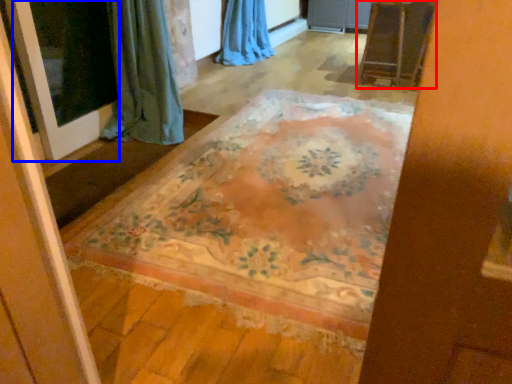
Question: Which of the following is the farthest to the observer, furniture (highlighted by a red box) or screen door (highlighted by a blue box)?

Choices:
 (A) furniture
 (B) screen door

Answer: (A)